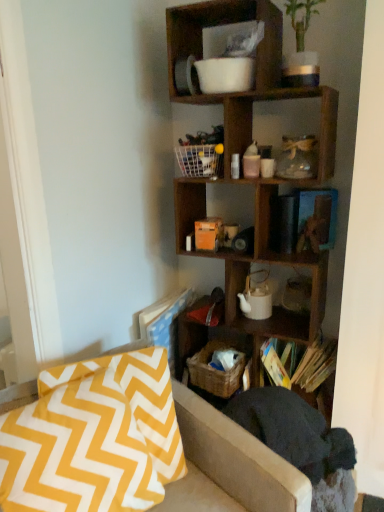
In order to click on wooden cube at upper right in this screenshot , I will do `click(244, 150)`.

What do you see at coordinates (244, 150) in the screenshot? This screenshot has height=512, width=384. I see `wooden cube at upper right` at bounding box center [244, 150].

At what (x,y) coordinates should I click in order to perform the action: click on dark gray fabric swivel chair at lower right. Please return your answer as a coordinate pair (x, y). Image resolution: width=384 pixels, height=512 pixels. Looking at the image, I should click on (238, 458).

The image size is (384, 512). I want to click on yellow zigzag fabric at lower left, so click(238, 458).

Describe the element at coordinates (137, 400) in the screenshot. I see `yellow zigzag fabric pillow at lower left` at that location.

You are a GUI agent. You are given a task and a screenshot of the screen. Output one action in this format:
    pyautogui.click(x=<x>, y=<y>)
    Task: Click on the white wire basket at center
    
    Given the screenshot: What is the action you would take?
    pyautogui.click(x=194, y=119)

Locate an element on the screen. The height and width of the screenshot is (512, 384). woven brown basket at lower center is located at coordinates (215, 371).

This screenshot has width=384, height=512. In order to click on wooden cube at upper right in this screenshot , I will do `click(244, 150)`.

Considering their positions, is woven brown basket at lower center located in front of or behind yellow zigzag fabric at lower left?

woven brown basket at lower center is positioned farther from the viewer than yellow zigzag fabric at lower left.

This screenshot has height=512, width=384. Identify the location of studio couch beneath the woven brown basket at lower center (from a real-world perspective). (238, 458).

Between point (216, 370) and point (216, 463), which one is positioned behind?

Point (216, 370)

Based on the photo, is yellow zigzag fabric at lower left completely or partially inside woven brown basket at lower center?

No, woven brown basket at lower center does not contain yellow zigzag fabric at lower left.

From the image's perspective, which one is positioned lower, woven brown basket at lower center or white wire basket at center?

woven brown basket at lower center is shown below in the image.

Does woven brown basket at lower center have a larger size compared to white wire basket at center?

Indeed, woven brown basket at lower center has a larger size compared to white wire basket at center.

Which object is thinner, woven brown basket at lower center or white wire basket at center?

Thinner between the two is white wire basket at center.

Does point (242, 369) lie behind point (194, 125)?

No, (242, 369) is in front of (194, 125).

Where is `cabinet on the right of the yellow zigzag fabric at lower left`? The height and width of the screenshot is (512, 384). cabinet on the right of the yellow zigzag fabric at lower left is located at coordinates (194, 119).

Between white wire basket at center and yellow zigzag fabric at lower left, which one has larger size?

yellow zigzag fabric at lower left is bigger.

Would you say white wire basket at center is to the left or to the right of yellow zigzag fabric at lower left in the picture?

From the image, it's evident that white wire basket at center is to the right of yellow zigzag fabric at lower left.

Considering the sizes of white wire basket at center and yellow zigzag fabric at lower left in the image, is white wire basket at center taller or shorter than yellow zigzag fabric at lower left?

In the image, white wire basket at center appears to be shorter than yellow zigzag fabric at lower left.

Does white wire basket at center touch yellow zigzag fabric pillow at lower left?

white wire basket at center and yellow zigzag fabric pillow at lower left are not in contact.

Where is `cabinet that is on the right side of yellow zigzag fabric pillow at lower left`? The height and width of the screenshot is (512, 384). cabinet that is on the right side of yellow zigzag fabric pillow at lower left is located at coordinates (194, 119).

How different are the orientations of white wire basket at center and yellow zigzag fabric pillow at lower left in degrees?

There is a 61.5-degree angle between the facing directions of white wire basket at center and yellow zigzag fabric pillow at lower left.

From the picture: Does white wire basket at center have a lesser width compared to yellow zigzag fabric pillow at lower left?

Yes.

Which is closer to the camera, (149, 386) or (207, 387)?

The point (149, 386) is closer to the camera.

From the image's perspective, which one is positioned lower, yellow zigzag fabric pillow at lower left or woven brown basket at lower center?

yellow zigzag fabric pillow at lower left.

Is yellow zigzag fabric pillow at lower left far from woven brown basket at lower center?

That's not correct — yellow zigzag fabric pillow at lower left is a little close to woven brown basket at lower center.

How many degrees apart are the facing directions of wooden book at lower right and woven brown basket at lower center?

There is a 10.1-degree angle between the facing directions of wooden book at lower right and woven brown basket at lower center.

Between wooden book at lower right and woven brown basket at lower center, which one is positioned in front?

wooden book at lower right is closer to the camera.

Which of these two, wooden book at lower right or woven brown basket at lower center, is wider?

wooden book at lower right is wider.

Which of these two, dark gray fabric swivel chair at lower right or yellow zigzag fabric pillow at lower left, is smaller?

yellow zigzag fabric pillow at lower left.

Is point (271, 461) positioned before point (161, 371)?

Yes.

Is dark gray fabric swivel chair at lower right to the left of yellow zigzag fabric pillow at lower left from the viewer's perspective?

No.

Which object is further away from the camera, dark gray fabric swivel chair at lower right or yellow zigzag fabric pillow at lower left?

dark gray fabric swivel chair at lower right is more distant.

The image size is (384, 512). Find the location of `crate on the right of yellow zigzag fabric at lower left`. crate on the right of yellow zigzag fabric at lower left is located at coordinates (215, 371).

What are the coordinates of `cabinet in front of the woven brown basket at lower center` in the screenshot? It's located at (194, 119).

When comparing their distances from wooden book at lower right, does yellow zigzag fabric pillow at lower left or dark gray fabric swivel chair at lower right seem closer?

dark gray fabric swivel chair at lower right.

Based on their spatial positions, is wooden cube at upper right or yellow zigzag fabric at lower left closer to wooden book at lower right?

wooden cube at upper right is closer to wooden book at lower right.

When comparing their distances from wooden cube at upper right, does white wire basket at center or woven brown basket at lower center seem further?

The object further to wooden cube at upper right is woven brown basket at lower center.

Considering their positions, is white wire basket at center positioned closer to woven brown basket at lower center than wooden cube at upper right?

Among the two, wooden cube at upper right is located nearer to woven brown basket at lower center.

Based on their spatial positions, is woven brown basket at lower center or yellow zigzag fabric pillow at lower left closer to wooden book at lower right?

Based on the image, woven brown basket at lower center appears to be nearer to wooden book at lower right.

Looking at the image, which one is located closer to yellow zigzag fabric at lower left, woven brown basket at lower center or white wire basket at center?

The object closer to yellow zigzag fabric at lower left is woven brown basket at lower center.

Based on their spatial positions, is white wire basket at center or wooden cube at upper right further from yellow zigzag fabric pillow at lower left?

The object further to yellow zigzag fabric pillow at lower left is white wire basket at center.

Which object lies nearer to the anchor point white wire basket at center, dark gray fabric swivel chair at lower right or woven brown basket at lower center?

Among the two, woven brown basket at lower center is located nearer to white wire basket at center.

Find the location of a particular element. The image size is (384, 512). crate between white wire basket at center and yellow zigzag fabric at lower left in the vertical direction is located at coordinates (215, 371).

Identify the location of pillow that lies between white wire basket at center and dark gray fabric swivel chair at lower right from top to bottom. The image size is (384, 512). (137, 400).

At what (x,y) coordinates should I click in order to perform the action: click on book that lies between wooden cube at upper right and dark gray fabric swivel chair at lower right from top to bottom. Please return your answer as a coordinate pair (x, y). This screenshot has height=512, width=384. Looking at the image, I should click on (302, 365).

At what (x,y) coordinates should I click in order to perform the action: click on book between yellow zigzag fabric pillow at lower left and woven brown basket at lower center from front to back. Please return your answer as a coordinate pair (x, y). The image size is (384, 512). Looking at the image, I should click on (302, 365).